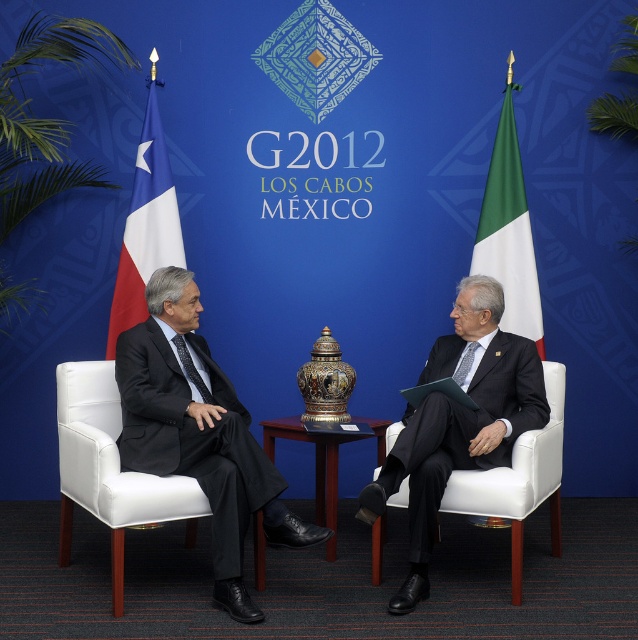
Can you confirm if white leather chair at left is wider than green fabric flag at right?

Yes.

Locate an element on the screen. white leather chair at left is located at coordinates [x=110, y=468].

Does white leather chair at left come in front of tricolor fabric flag at left?

Yes, it is.

Measure the distance between point (61, 525) and camera.

Point (61, 525) is 3.76 meters away from camera.

The height and width of the screenshot is (640, 638). In order to click on white leather chair at left in this screenshot , I will do pyautogui.click(x=110, y=468).

Between point (218, 374) and point (322, 488), which one is positioned behind?

Positioned behind is point (322, 488).

Where is `dark gray suit at left`? This screenshot has height=640, width=638. dark gray suit at left is located at coordinates (198, 433).

Who is more distant from viewer, (188, 404) or (378, 433)?

Positioned behind is point (378, 433).

This screenshot has height=640, width=638. What are the coordinates of `dark gray suit at left` in the screenshot? It's located at (198, 433).